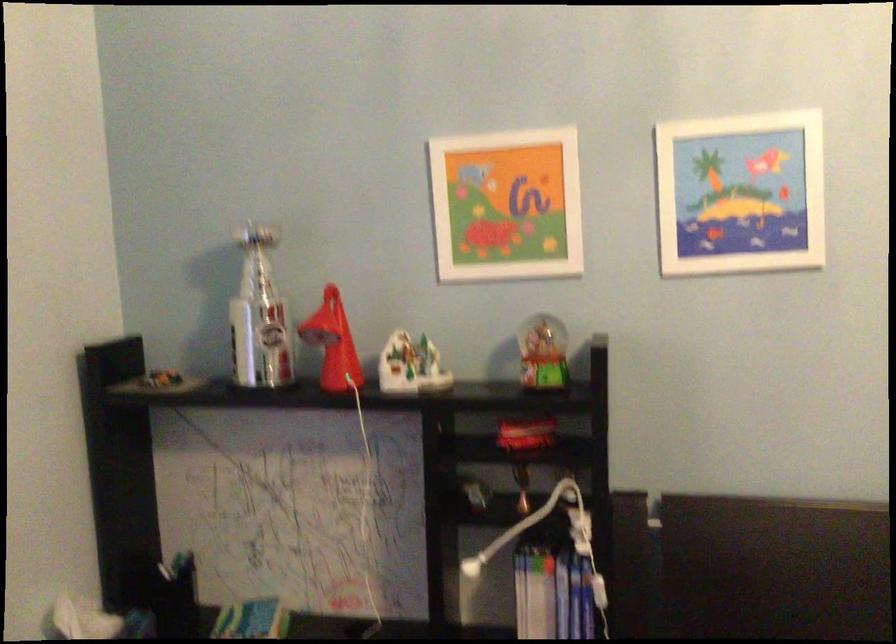
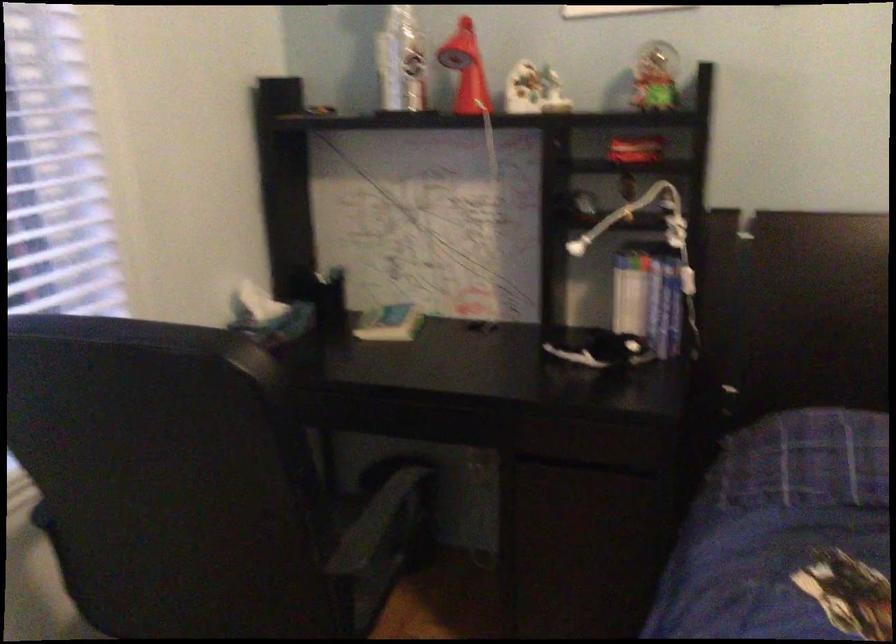
Where in the second image is the point corresponding to point 546,355 from the first image?

(655, 77)